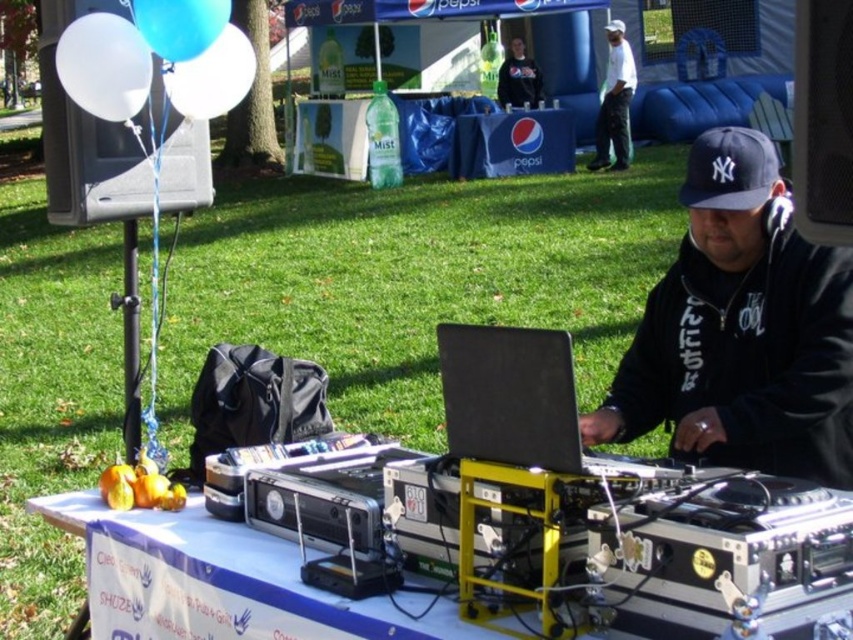
Looking at the DJ booth area, which object is positioned to the left of the other between the blue fabric pepsi banner at upper center and the white cotton shirt at upper center?

The blue fabric pepsi banner at upper center is to the left of the white cotton shirt at upper center.

You are a photographer at the event and want to capture a clear photo of the black matte laptop at center and the black fabric baseball cap at center. Which object is blocking the view of the other?

The black fabric baseball cap at center is blocking the view of the black matte laptop at center because it is positioned above it.

You are a photographer at the event and want to capture both the blue fabric pepsi banner at upper center and the white cotton shirt at upper center in a single frame. Which object should you focus on first to ensure both are in the frame?

The blue fabric pepsi banner at upper center is shorter than the white cotton shirt at upper center, so you should focus on the white cotton shirt at upper center first to ensure both are in the frame.